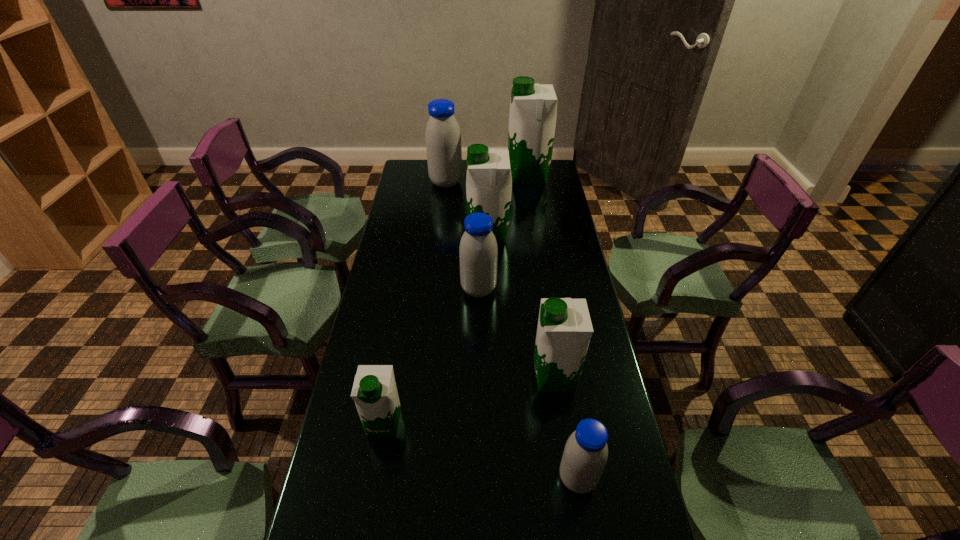
This screenshot has height=540, width=960. Identify the location of vacant region at the right edge of the desktop. (541, 246).

This screenshot has width=960, height=540. I want to click on vacant space at the far left corner, so click(x=415, y=163).

Where is `free space between the leftmost green soya milk and the biggest blue soya milk`? This screenshot has width=960, height=540. free space between the leftmost green soya milk and the biggest blue soya milk is located at coordinates (416, 303).

Locate an element on the screen. The width and height of the screenshot is (960, 540). empty space that is in between the nearest blue soya milk and the sixth farthest object is located at coordinates (481, 451).

Where is `vacant area that lies between the leftmost blue soya milk and the second smallest green soya milk`? The image size is (960, 540). vacant area that lies between the leftmost blue soya milk and the second smallest green soya milk is located at coordinates (500, 280).

Locate an element on the screen. The width and height of the screenshot is (960, 540). free spot between the third biggest green soya milk and the tallest soya milk is located at coordinates click(541, 276).

I want to click on free space between the second nearest green soya milk and the third smallest green soya milk, so click(x=521, y=306).

Locate an element on the screen. The image size is (960, 540). free space between the second farthest green soya milk and the fifth farthest soya milk is located at coordinates (521, 306).

Image resolution: width=960 pixels, height=540 pixels. What are the coordinates of `object that ranks as the second closest to the second biggest green soya milk` in the screenshot? It's located at (443, 137).

Image resolution: width=960 pixels, height=540 pixels. I want to click on object identified as the fourth closest to the fourth farthest object, so click(x=585, y=455).